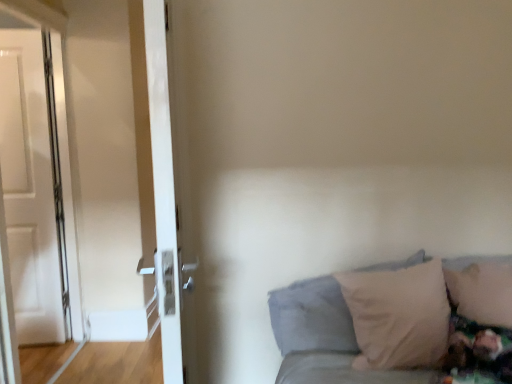
Question: From a real-world perspective, does soft beige pillow at lower right, positioned as the first pillow in left-to-right order, stand above white glossy door at left, placed as the 2th door when sorted from front to back?

Choices:
 (A) no
 (B) yes

Answer: (A)

Question: Does soft beige pillow at lower right, positioned as the first pillow in left-to-right order, have a larger size compared to white glossy door at left, the first door viewed from the left?

Choices:
 (A) yes
 (B) no

Answer: (A)

Question: Considering the relative sizes of soft beige pillow at lower right, positioned as the first pillow in left-to-right order, and white glossy door at left, the second door from the right, in the image provided, is soft beige pillow at lower right, positioned as the first pillow in left-to-right order, wider than white glossy door at left, the second door from the right,?

Choices:
 (A) yes
 (B) no

Answer: (A)

Question: Is white glossy door at left, the first door viewed from the left, surrounded by soft beige pillow at lower right, which appears as the second pillow when viewed from the right?

Choices:
 (A) no
 (B) yes

Answer: (A)

Question: Is soft beige pillow at lower right, which appears as the second pillow when viewed from the right, thinner than white glossy door at left, the second door from the right?

Choices:
 (A) yes
 (B) no

Answer: (B)

Question: From the image's perspective, is soft beige pillow at lower right, which appears as the second pillow when viewed from the right, over white glossy door at left, placed as the 2th door when sorted from front to back?

Choices:
 (A) no
 (B) yes

Answer: (A)

Question: Does beige soft pillow at lower right, the second pillow positioned from the left, turn towards soft beige pillow at lower right, which appears as the second pillow when viewed from the right?

Choices:
 (A) yes
 (B) no

Answer: (B)

Question: From a real-world perspective, is beige soft pillow at lower right, which is the first pillow from right to left, physically below soft beige pillow at lower right, which appears as the second pillow when viewed from the right?

Choices:
 (A) yes
 (B) no

Answer: (B)

Question: Is the surface of beige soft pillow at lower right, which is the first pillow from right to left, in direct contact with soft beige pillow at lower right, positioned as the first pillow in left-to-right order?

Choices:
 (A) no
 (B) yes

Answer: (A)

Question: Is beige soft pillow at lower right, which is the first pillow from right to left, not inside soft beige pillow at lower right, which appears as the second pillow when viewed from the right?

Choices:
 (A) yes
 (B) no

Answer: (A)

Question: Is beige soft pillow at lower right, the second pillow positioned from the left, smaller than soft beige pillow at lower right, positioned as the first pillow in left-to-right order?

Choices:
 (A) no
 (B) yes

Answer: (B)

Question: Does beige soft pillow at lower right, which is the first pillow from right to left, have a greater height compared to soft beige pillow at lower right, which appears as the second pillow when viewed from the right?

Choices:
 (A) no
 (B) yes

Answer: (A)

Question: Is beige soft pillow at lower right, the second pillow positioned from the left, to the left of white glossy door at left, the 2th door when ordered from left to right, from the viewer's perspective?

Choices:
 (A) yes
 (B) no

Answer: (B)